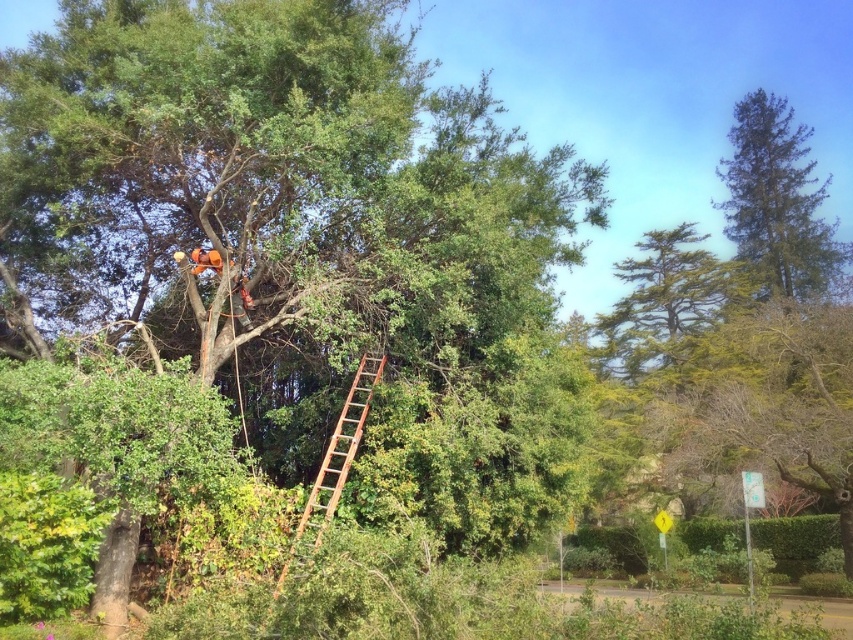
Question: Which point appears closest to the camera in this image?

Choices:
 (A) (47, 193)
 (B) (639, 268)
 (C) (329, 484)

Answer: (C)

Question: Can you confirm if green textured tree at upper right is smaller than rusty wood ladder at center?

Choices:
 (A) no
 (B) yes

Answer: (A)

Question: Can you confirm if green textured tree at upper right is positioned below rusty wood ladder at center?

Choices:
 (A) no
 (B) yes

Answer: (A)

Question: Which object is closer to the camera taking this photo?

Choices:
 (A) rusty wood ladder at center
 (B) green leafy tree at upper center

Answer: (A)

Question: Which point is closer to the camera?

Choices:
 (A) rusty wood ladder at center
 (B) green leafy tree at upper center

Answer: (A)

Question: Is green leafy tree at upper center to the right of green textured tree at upper right from the viewer's perspective?

Choices:
 (A) no
 (B) yes

Answer: (A)